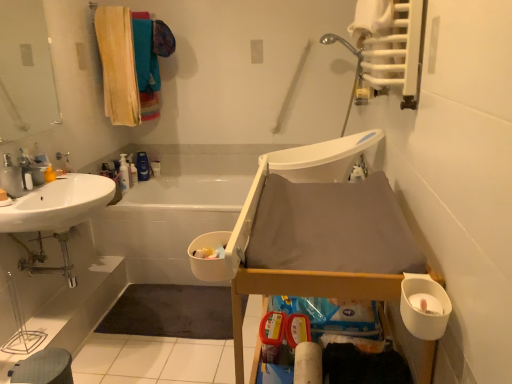
Where is `white matte toilet paper at lower center, which appears as the 2th toilet paper when viewed from the front`? white matte toilet paper at lower center, which appears as the 2th toilet paper when viewed from the front is located at coordinates (308, 364).

Describe the element at coordinates (168, 223) in the screenshot. This screenshot has width=512, height=384. I see `white plastic bath at lower left` at that location.

Where is `white plastic bath at lower left`? white plastic bath at lower left is located at coordinates (168, 223).

Identify the location of white matte toilet paper at lower right, arranged as the first toilet paper when viewed from the right. (425, 306).

The image size is (512, 384). What do you see at coordinates (133, 174) in the screenshot?
I see `translucent plastic bottle at upper center, marked as the 2th toiletry in a front-to-back arrangement` at bounding box center [133, 174].

Locate an element on the screen. The width and height of the screenshot is (512, 384). translucent plastic bottle at upper center, marked as the 2th toiletry in a front-to-back arrangement is located at coordinates (133, 174).

Where is `gray fabric step stool at lower left`? gray fabric step stool at lower left is located at coordinates (44, 368).

What do you see at coordinates (11, 178) in the screenshot?
I see `matte silver faucet at left` at bounding box center [11, 178].

At what (x,y) coordinates should I click in order to perform the action: click on white matte toilet paper at lower center, which appears as the 2th toilet paper when viewed from the front. Please return your answer as a coordinate pair (x, y). Image resolution: width=512 pixels, height=384 pixels. Looking at the image, I should click on (308, 364).

Is transparent glass mirror at upper left facing away from gray fabric step stool at lower left?

transparent glass mirror at upper left does not have its back to gray fabric step stool at lower left.

Is the depth of transparent glass mirror at upper left greater than that of gray fabric step stool at lower left?

No, the depth of transparent glass mirror at upper left is less than that of gray fabric step stool at lower left.

Between transparent glass mirror at upper left and gray fabric step stool at lower left, which one has more height?

transparent glass mirror at upper left is taller.

How many degrees apart are the facing directions of white matte toilet paper at lower center, placed as the 2th toilet paper when sorted from right to left, and gray fabric step stool at lower left?

They differ by 178 degrees in their facing directions.

From their relative heights in the image, would you say white matte toilet paper at lower center, placed as the 2th toilet paper when sorted from right to left, is taller or shorter than gray fabric step stool at lower left?

Considering their sizes, white matte toilet paper at lower center, placed as the 2th toilet paper when sorted from right to left, has less height than gray fabric step stool at lower left.

Is white matte toilet paper at lower center, placed as the 2th toilet paper when sorted from right to left, closer to camera compared to gray fabric step stool at lower left?

Yes, white matte toilet paper at lower center, placed as the 2th toilet paper when sorted from right to left, is in front of gray fabric step stool at lower left.

Which of these two, white matte toilet paper at lower center, which is the 1th toilet paper in bottom-to-top order, or gray fabric step stool at lower left, is thinner?

white matte toilet paper at lower center, which is the 1th toilet paper in bottom-to-top order.

Which of these two, matte silver faucet at left or white glossy sink at left, stands shorter?

With less height is white glossy sink at left.

Does matte silver faucet at left have a smaller size compared to white glossy sink at left?

Yes, matte silver faucet at left is smaller than white glossy sink at left.

Would you say matte silver faucet at left is a long distance from white glossy sink at left?

No, matte silver faucet at left is in close proximity to white glossy sink at left.

Can you confirm if white plastic bath at lower left is smaller than gray fabric step stool at lower left?

Incorrect, white plastic bath at lower left is not smaller in size than gray fabric step stool at lower left.

Where is `step stool lying in front of the white plastic bath at lower left`? step stool lying in front of the white plastic bath at lower left is located at coordinates (44, 368).

Can you confirm if white plastic bath at lower left is shorter than gray fabric step stool at lower left?

Incorrect, the height of white plastic bath at lower left does not fall short of that of gray fabric step stool at lower left.

Between transparent glass mirror at upper left and white matte toilet paper at lower center, which is the 1th toilet paper in bottom-to-top order, which one has smaller width?

With smaller width is white matte toilet paper at lower center, which is the 1th toilet paper in bottom-to-top order.

Is transparent glass mirror at upper left taller than white matte toilet paper at lower center, which is the 1th toilet paper in bottom-to-top order?

Correct, transparent glass mirror at upper left is much taller as white matte toilet paper at lower center, which is the 1th toilet paper in bottom-to-top order.

How different are the orientations of transparent glass mirror at upper left and white matte toilet paper at lower center, placed as the 2th toilet paper when sorted from right to left, in degrees?

There is a 179-degree angle between the facing directions of transparent glass mirror at upper left and white matte toilet paper at lower center, placed as the 2th toilet paper when sorted from right to left.

Considering the relative positions of transparent glass mirror at upper left and white matte toilet paper at lower center, placed as the 2th toilet paper when sorted from top to bottom, in the image provided, is transparent glass mirror at upper left behind white matte toilet paper at lower center, placed as the 2th toilet paper when sorted from top to bottom,?

Yes, transparent glass mirror at upper left is behind white matte toilet paper at lower center, placed as the 2th toilet paper when sorted from top to bottom.

Would you say white matte toilet paper at lower right, which is the 2th toilet paper in bottom-to-top order, contains transparent glass mirror at upper left?

Actually, transparent glass mirror at upper left is outside white matte toilet paper at lower right, which is the 2th toilet paper in bottom-to-top order.

Which point is more forward, (423, 296) or (36, 5)?

The point (423, 296) is in front.

Considering the positions of objects white matte toilet paper at lower right, arranged as the first toilet paper when viewed from the right, and transparent glass mirror at upper left in the image provided, who is more to the right, white matte toilet paper at lower right, arranged as the first toilet paper when viewed from the right, or transparent glass mirror at upper left?

white matte toilet paper at lower right, arranged as the first toilet paper when viewed from the right.

You are a GUI agent. You are given a task and a screenshot of the screen. Output one action in this format:
    pyautogui.click(x=<x>, y=<y>)
    Task: Click on the mirror located on the left of white matte toilet paper at lower right, arranged as the first toilet paper when viewed from the right
    The width and height of the screenshot is (512, 384).
    Given the screenshot: What is the action you would take?
    pyautogui.click(x=25, y=71)

From the image's perspective, which one is positioned lower, brushed metal faucet at upper left or white glossy bottle at upper left, which is counted as the 2th toiletry, starting from the back?

From the image's view, white glossy bottle at upper left, which is counted as the 2th toiletry, starting from the back, is below.

Does point (56, 154) come closer to viewer compared to point (125, 171)?

That is True.

Is brushed metal faucet at upper left positioned with its back to white glossy bottle at upper left, which is counted as the 2th toiletry, starting from the back?

That's not correct — brushed metal faucet at upper left is not looking away from white glossy bottle at upper left, which is counted as the 2th toiletry, starting from the back.

This screenshot has width=512, height=384. What are the coordinates of `step stool that appears on the right of transparent glass mirror at upper left` in the screenshot? It's located at (44, 368).

In order to click on step stool lying behind the white matte toilet paper at lower center, placed as the 2th toilet paper when sorted from right to left in this screenshot , I will do `click(44, 368)`.

Looking at the image, which one is located closer to transparent glass mirror at upper left, brushed metal faucet at upper left or white matte toilet paper at lower right, arranged as the first toilet paper when viewed from the right?

The object closer to transparent glass mirror at upper left is brushed metal faucet at upper left.

When comparing their distances from white glossy sink at left, does translucent plastic bottle at upper center, marked as the 2th toiletry in a front-to-back arrangement, or white glossy bottle at upper left, which is counted as the 2th toiletry, starting from the back, seem further?

Based on the image, translucent plastic bottle at upper center, marked as the 2th toiletry in a front-to-back arrangement, appears to be further to white glossy sink at left.

From the image, which object appears to be nearer to white plastic bath at lower left, white glossy sink at left or transparent glass mirror at upper left?

The object closer to white plastic bath at lower left is white glossy sink at left.

Looking at the image, which one is located further to gray fabric step stool at lower left, brushed metal faucet at upper left or white matte toilet paper at lower right, arranged as the first toilet paper when viewed from the right?

white matte toilet paper at lower right, arranged as the first toilet paper when viewed from the right.

Based on their spatial positions, is matte silver faucet at left or soft yellow towel at upper left further from white matte toilet paper at lower right, the second toilet paper positioned from the left?

The object further to white matte toilet paper at lower right, the second toilet paper positioned from the left, is soft yellow towel at upper left.

Estimate the real-world distances between objects in this image. Which object is closer to white glossy bottle at upper left, the first toiletry viewed from the front, white plastic bath at lower left or white matte toilet paper at lower right, marked as the first toilet paper in a top-to-bottom arrangement?

white plastic bath at lower left lies closer to white glossy bottle at upper left, the first toiletry viewed from the front, than the other object.

When comparing their distances from white glossy sink at left, does transparent glass mirror at upper left or white matte toilet paper at lower right, arranged as the first toilet paper when viewed from the right, seem further?

Based on the image, white matte toilet paper at lower right, arranged as the first toilet paper when viewed from the right, appears to be further to white glossy sink at left.

Which object lies further to the anchor point brushed metal faucet at upper left, gray fabric step stool at lower left or white glossy sink at left?

The object further to brushed metal faucet at upper left is gray fabric step stool at lower left.

Find the location of a particular element. Image resolution: width=512 pixels, height=384 pixels. tap positioned between transparent glass mirror at upper left and white glossy bottle at upper left, the first toiletry viewed from the front, from near to far is located at coordinates (11, 178).

You are a GUI agent. You are given a task and a screenshot of the screen. Output one action in this format:
    pyautogui.click(x=<x>, y=<y>)
    Task: Click on the plumbing fixture located between matte silver faucet at left and white matte toilet paper at lower right, which is the 2th toilet paper in bottom-to-top order, in the left-right direction
    Image resolution: width=512 pixels, height=384 pixels.
    Given the screenshot: What is the action you would take?
    pyautogui.click(x=62, y=156)

Where is `plumbing fixture between matte silver faucet at left and white plastic bath at lower left`? The image size is (512, 384). plumbing fixture between matte silver faucet at left and white plastic bath at lower left is located at coordinates (62, 156).

Identify the location of sink between transparent glass mirror at upper left and white plastic bath at lower left in the front-back direction. Image resolution: width=512 pixels, height=384 pixels. (58, 204).